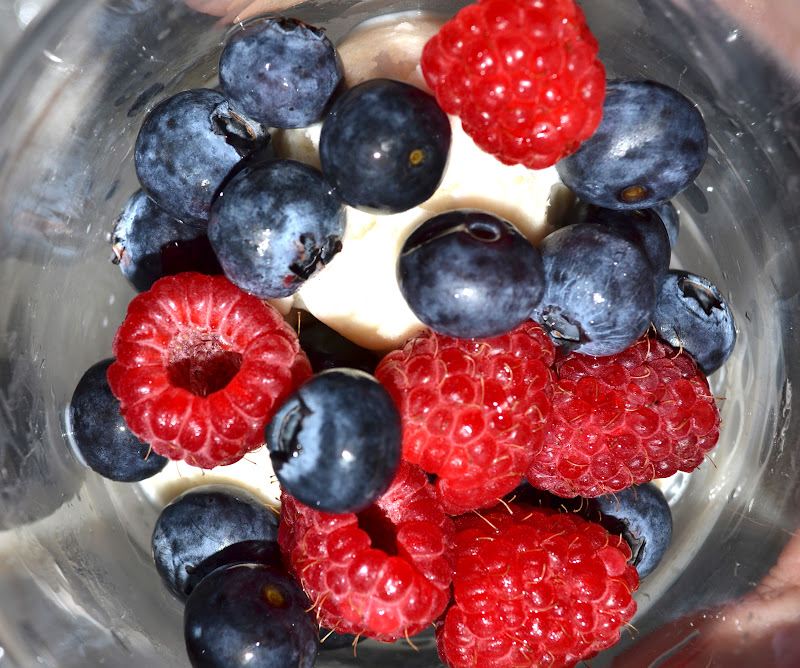
In order to click on bottom of glass jar in this screenshot , I will do `click(122, 320)`.